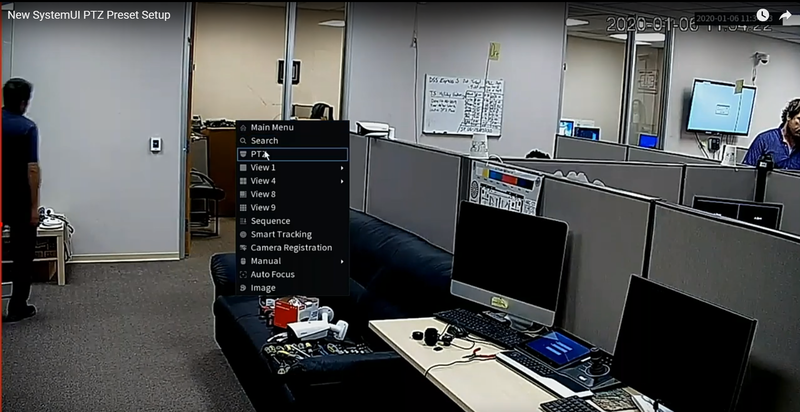
I want to click on floor, so click(150, 386).